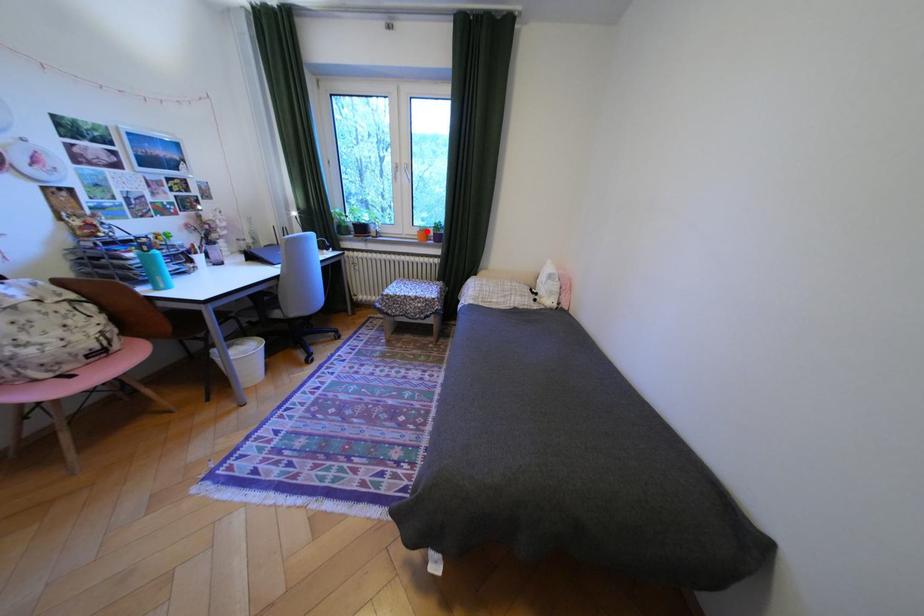
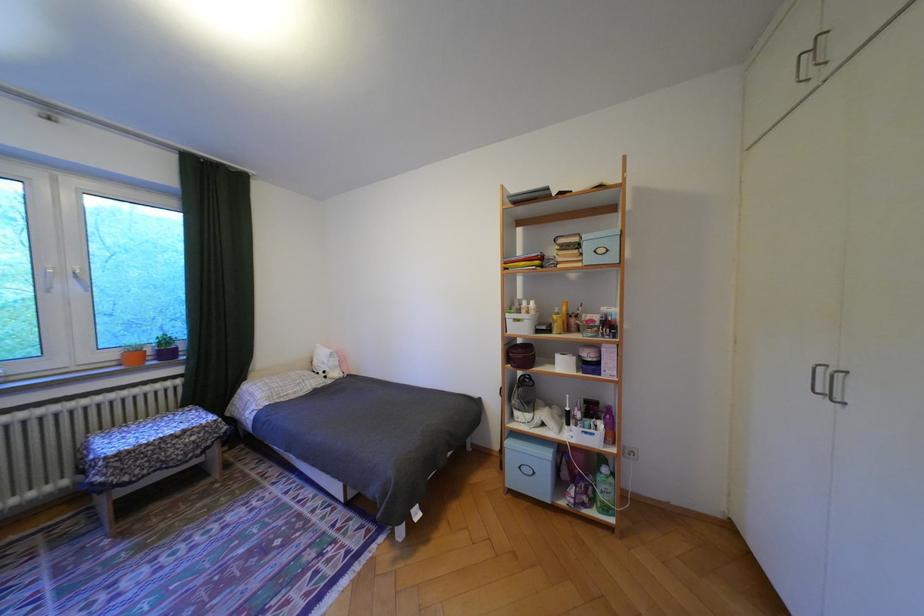
The point at the highlighted location is marked in the first image. Where is the corresponding point in the second image?

(124, 355)